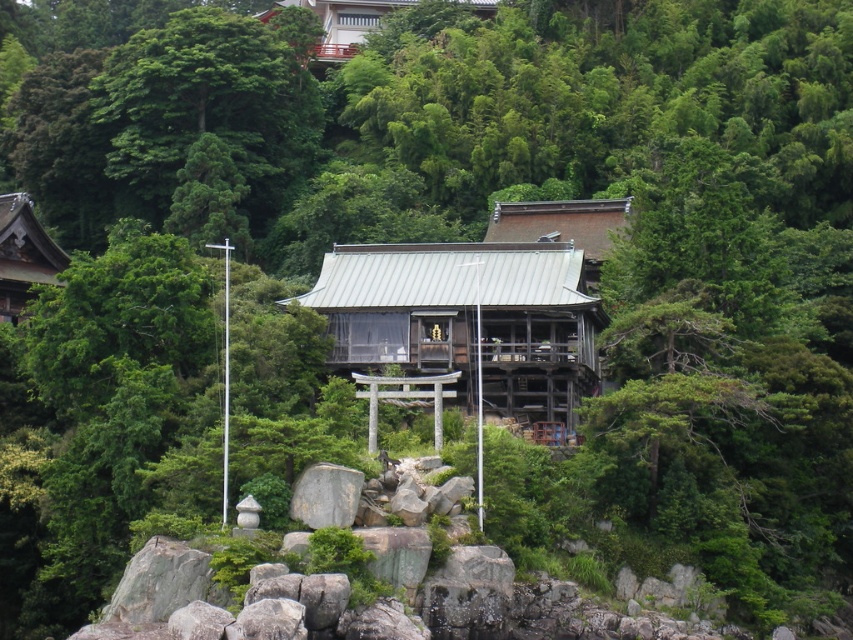
You are standing at the camera position and want to visit the shrine. The path to the shrine is straight and clear. Your walking speed is 1.2 meters per second. Approximately how many seconds will it take you to reach the matte wooden shrine at upper left?

The matte wooden shrine at upper left is 93.82 meters away. At a walking speed of 1.2 meters per second, it would take approximately 78.18 seconds to reach it. Since the path is straight and clear, you can expect to arrive in about 78 seconds.

You are a visitor exploring the serene landscape and want to take a photo of both the green wooden hut at center and the matte wooden shrine at upper left in the same frame. Based on their sizes, which one should you position closer to the camera to ensure both are visible clearly?

The green wooden hut at center is larger than the matte wooden shrine at upper left. To capture both clearly in the same frame, position the green wooden hut at center closer to the camera so its larger size doesn